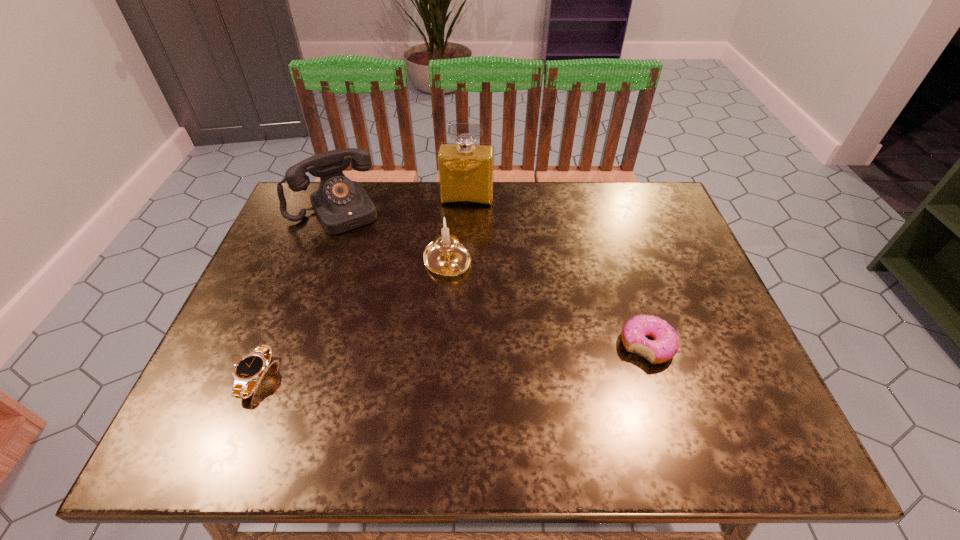
Locate an element on the screen. Image resolution: width=960 pixels, height=540 pixels. free space between the perfume and the telephone is located at coordinates (400, 205).

Find the location of a particular element. Image resolution: width=960 pixels, height=540 pixels. empty space between the watch and the second shortest object is located at coordinates (451, 362).

Locate an element on the screen. This screenshot has width=960, height=540. free space between the candle holder and the perfume is located at coordinates (457, 232).

Find the location of `vacant area that lies between the doughnut and the watch`. vacant area that lies between the doughnut and the watch is located at coordinates (451, 362).

You are a GUI agent. You are given a task and a screenshot of the screen. Output one action in this format:
    pyautogui.click(x=<x>, y=<y>)
    Task: Click on the free space between the third farthest object and the rightmost object
    
    Given the screenshot: What is the action you would take?
    pyautogui.click(x=547, y=305)

Where is `blank region between the candle holder and the watch`? blank region between the candle holder and the watch is located at coordinates (351, 321).

Locate an element on the screen. The width and height of the screenshot is (960, 540). vacant area that lies between the telephone and the shortest object is located at coordinates pos(295,294).

Where is `free space between the candle holder and the telephone`? free space between the candle holder and the telephone is located at coordinates (391, 237).

The image size is (960, 540). Find the location of `unoccupied area between the telephone and the shortest object`. unoccupied area between the telephone and the shortest object is located at coordinates (295, 294).

The width and height of the screenshot is (960, 540). What are the coordinates of `object identified as the third closest to the rightmost object` in the screenshot? It's located at (340, 204).